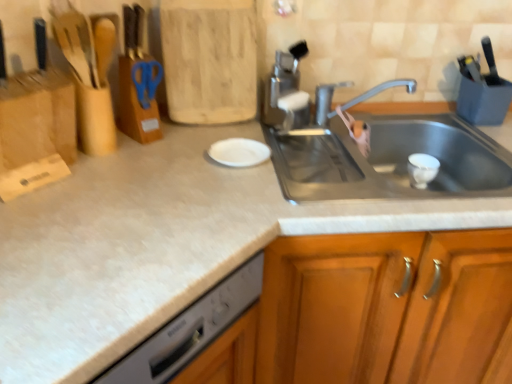
Locate an element on the screen. This screenshot has height=384, width=512. free location in front of satin nickel faucet at upper center is located at coordinates (309, 150).